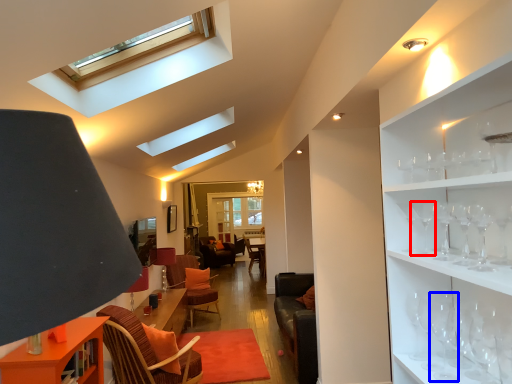
Question: Which of the following is the closest to the observer, wine glass (highlighted by a red box) or wine glass (highlighted by a blue box)?

Choices:
 (A) wine glass
 (B) wine glass

Answer: (B)